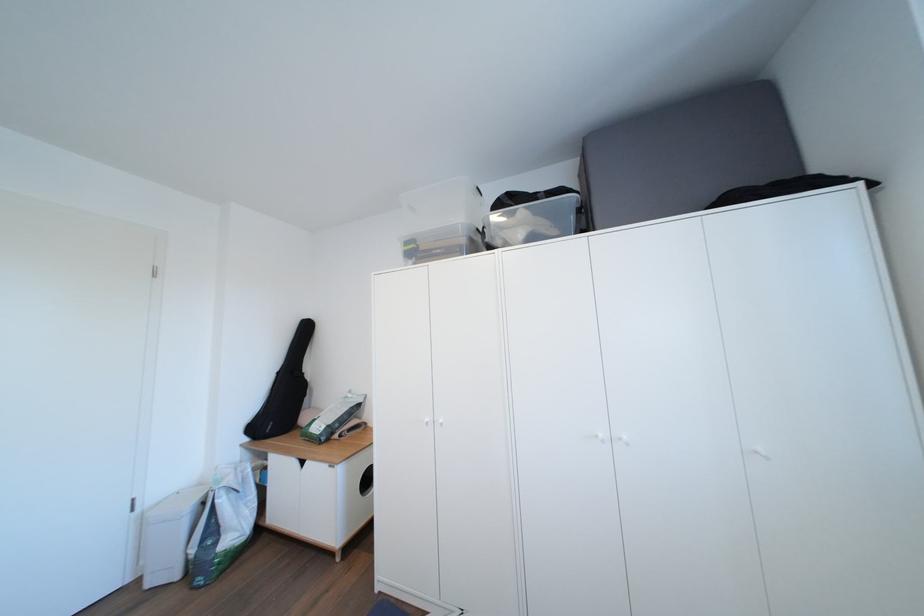
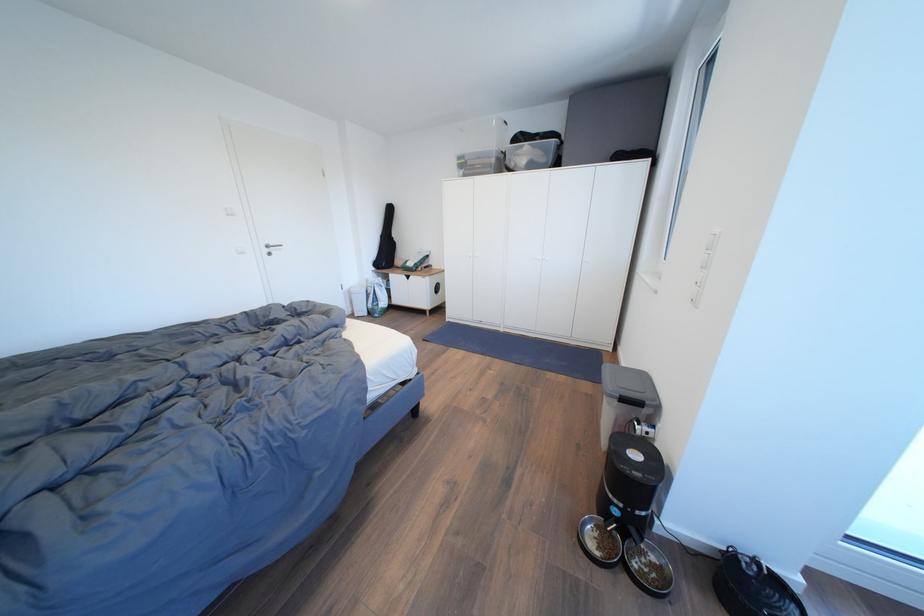
In the second image, find the point that corresponds to (286,378) in the first image.

(388, 241)